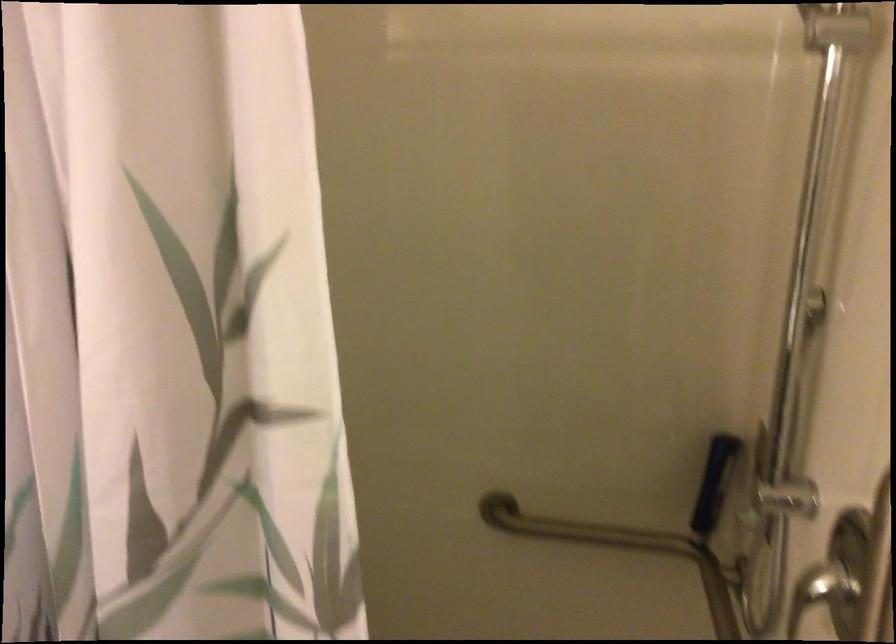
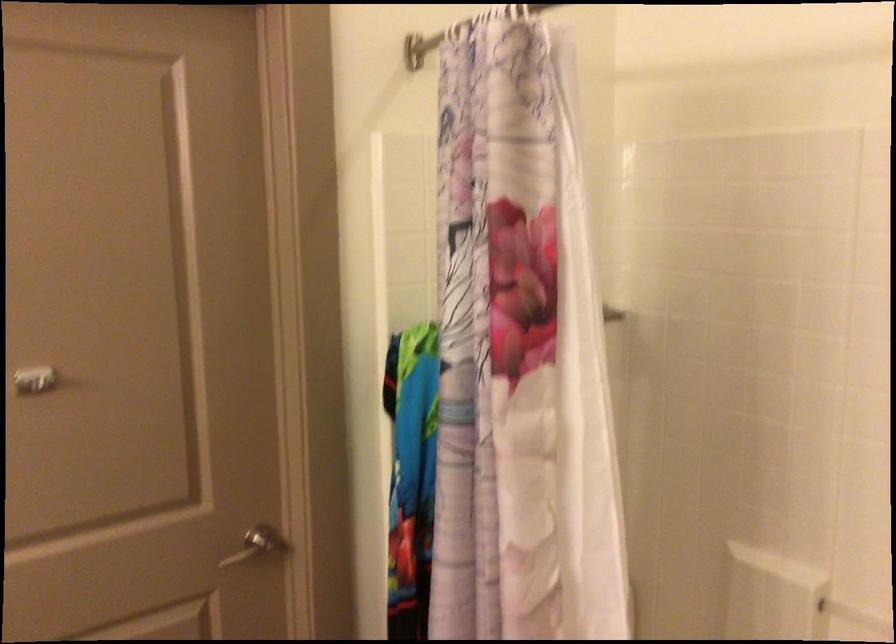
Question: The camera is either moving clockwise (left) or counter-clockwise (right) around the object. The first image is from the beginning of the video and the second image is from the end. Is the camera moving left or right when shooting the video?

Choices:
 (A) Left
 (B) Right

Answer: (B)